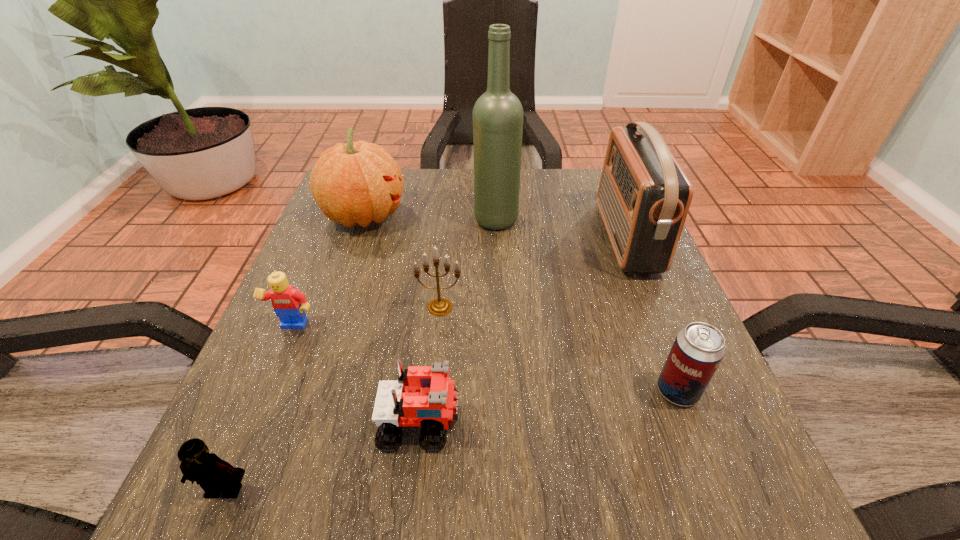
Locate an element on the screen. The image size is (960, 540). pumpkin present at the far edge is located at coordinates (354, 183).

Locate an element on the screen. The width and height of the screenshot is (960, 540). object that is at the near edge is located at coordinates (215, 476).

I want to click on pumpkin that is at the left edge, so click(354, 183).

Where is `radio receiver that is at the right edge`? The width and height of the screenshot is (960, 540). radio receiver that is at the right edge is located at coordinates (644, 196).

Find the location of `beer can that is at the right edge`. beer can that is at the right edge is located at coordinates (699, 348).

Identify the location of object at the far left corner. Image resolution: width=960 pixels, height=540 pixels. (354, 183).

In order to click on object that is at the near left corner in this screenshot , I will do `click(215, 476)`.

The width and height of the screenshot is (960, 540). I want to click on object located at the far right corner, so click(x=644, y=196).

Locate an element on the screen. The image size is (960, 540). free spot at the far edge of the desktop is located at coordinates coord(563,211).

This screenshot has height=540, width=960. I want to click on vacant space at the near edge of the desktop, so click(585, 473).